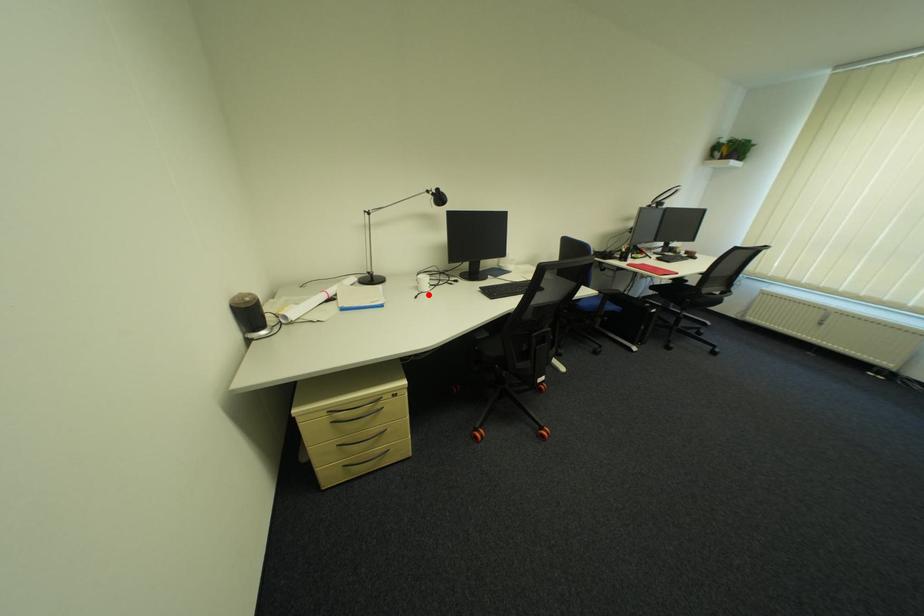
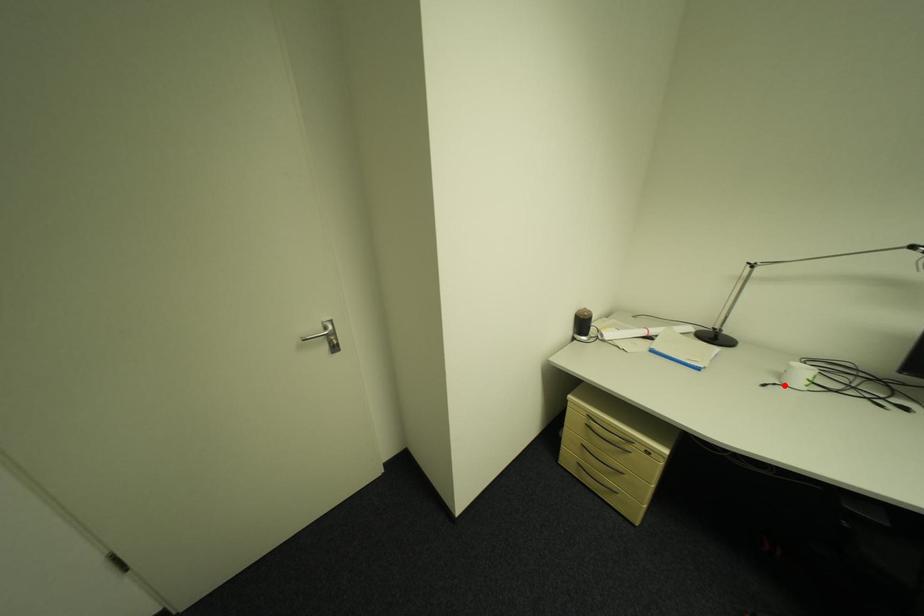
I am providing you with two images of the same scene from different viewpoints. A red point is marked on the first image and another point is marked on the second image. Is the marked point in image1 the same physical position as the marked point in image2?

Yes